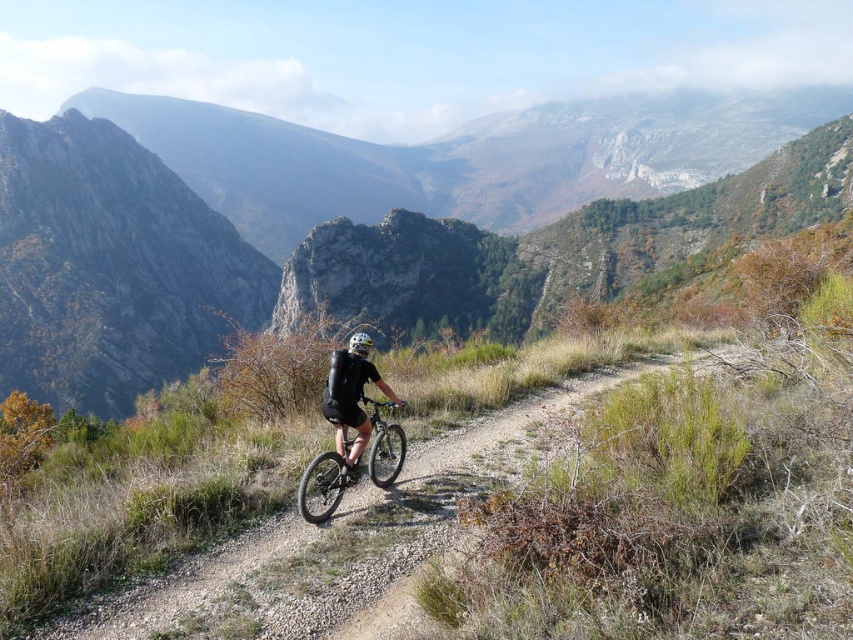
Question: Which point appears farthest from the camera in this image?

Choices:
 (A) (254, 189)
 (B) (352, 337)

Answer: (A)

Question: Among these objects, which one is farthest from the camera?

Choices:
 (A) rugged stone mountain at center
 (B) white matte bicycle helmet at center
 (C) black matte shorts at center
 (D) shiny metallic bicycle at center

Answer: (A)

Question: Which point is closer to the camera?

Choices:
 (A) (36, 260)
 (B) (363, 348)
 (C) (368, 342)
 (D) (363, 401)

Answer: (C)

Question: Does shiny metallic bicycle at center have a larger size compared to white matte bicycle helmet at center?

Choices:
 (A) no
 (B) yes

Answer: (B)

Question: Is the position of rugged stone mountain at center more distant than that of black matte shorts at center?

Choices:
 (A) yes
 (B) no

Answer: (A)

Question: Can you confirm if shiny metallic bicycle at center is bigger than white matte bicycle helmet at center?

Choices:
 (A) yes
 (B) no

Answer: (A)